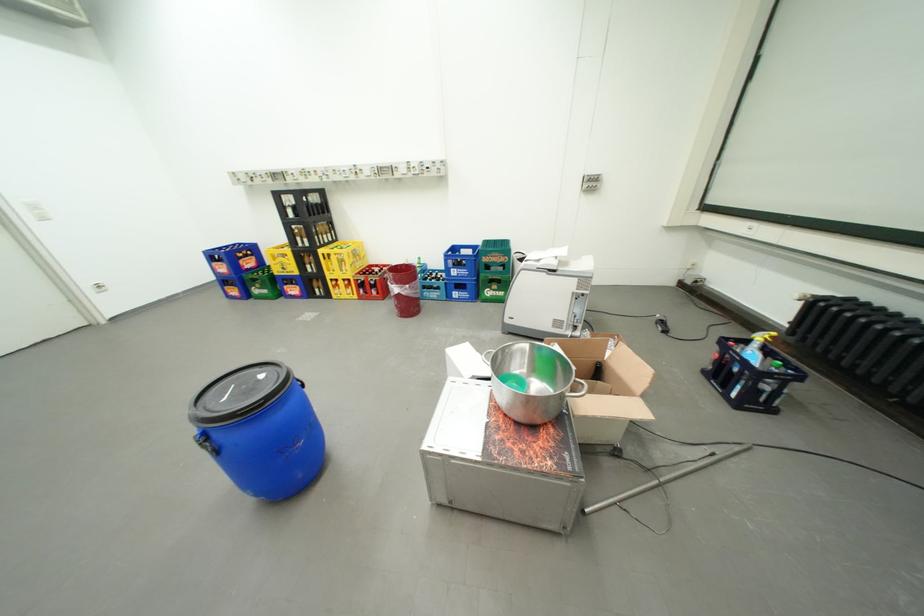
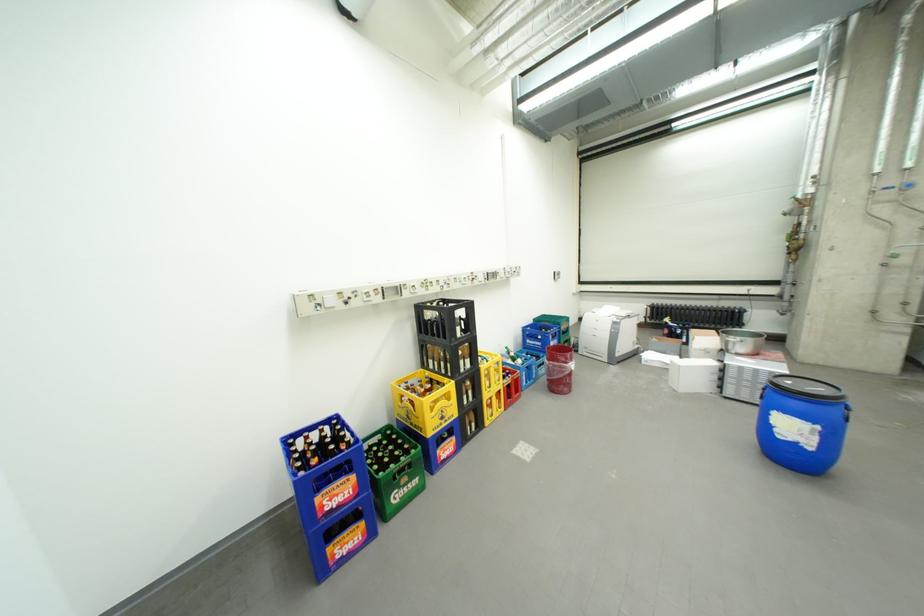
Locate, in the second image, the point that corresponds to (463,270) in the first image.

(562, 344)